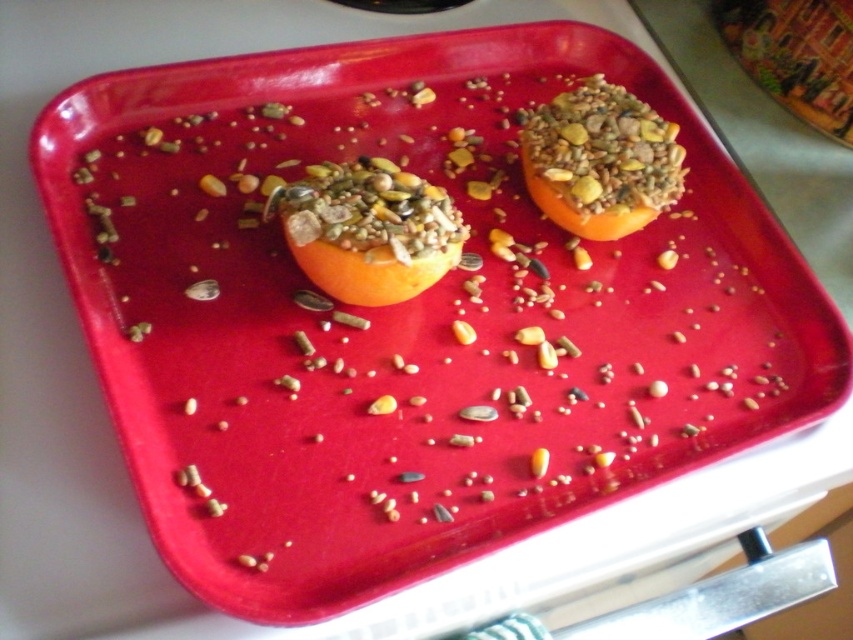
You are organizing a fruit platter and need to place the orange matte at center and the orange textured fruit at upper right. If you want to arrange them so that the one closer to the viewer is on the left side of the platter, which orange should you place there?

The orange matte at center is closer to the viewer than the orange textured fruit at upper right, so you should place the orange matte at center on the left side of the platter.

You are arranging fruits on a tray for a party. You have an orange matte at center and an orange textured fruit at upper right. Which orange is located to the left of the other?

The orange matte at center is positioned on the left side of orange textured fruit at upper right, so the orange matte at center is to the left of the orange textured fruit at upper right.